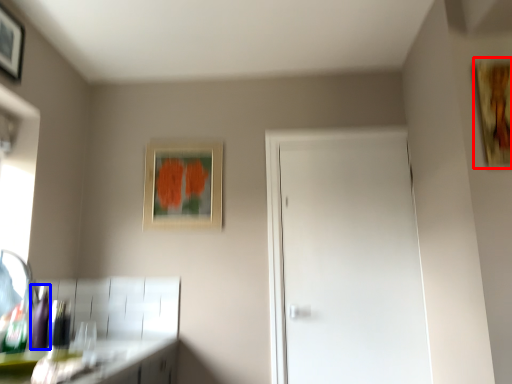
Question: Which object appears farthest to the camera in this image, picture frame (highlighted by a red box) or bottle (highlighted by a blue box)?

Choices:
 (A) picture frame
 (B) bottle

Answer: (B)